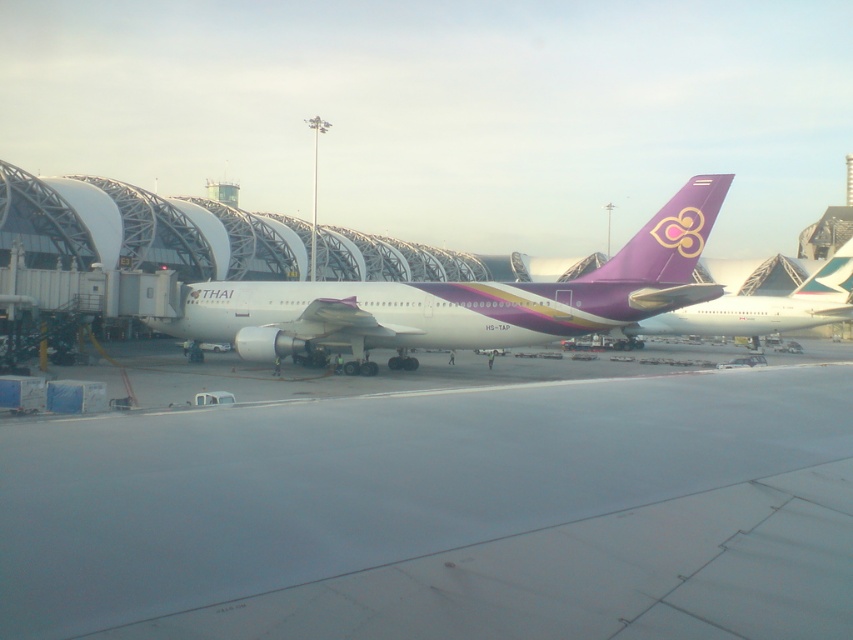
This screenshot has height=640, width=853. Identify the location of smooth concrete runway at center. (444, 513).

Which is below, smooth concrete runway at center or purple glossy airplane at upper right?

Positioned lower is smooth concrete runway at center.

Who is more forward, (428, 589) or (775, 321)?

Point (428, 589) is more forward.

Image resolution: width=853 pixels, height=640 pixels. Find the location of `smooth concrete runway at center`. smooth concrete runway at center is located at coordinates (444, 513).

Between smooth concrete runway at center and white glossy airplane at center, which one has more height?

white glossy airplane at center is taller.

Can you confirm if smooth concrete runway at center is positioned to the left of white glossy airplane at center?

In fact, smooth concrete runway at center is to the right of white glossy airplane at center.

What do you see at coordinates (444, 513) in the screenshot? The image size is (853, 640). I see `smooth concrete runway at center` at bounding box center [444, 513].

The image size is (853, 640). I want to click on smooth concrete runway at center, so click(444, 513).

Which is more to the left, white glossy airplane at center or purple glossy airplane at upper right?

white glossy airplane at center

Is point (309, 284) positioned behind point (674, 308)?

That is True.

Who is more forward, (x=202, y=321) or (x=688, y=326)?

Point (x=202, y=321) is more forward.

This screenshot has height=640, width=853. I want to click on white glossy airplane at center, so click(463, 298).